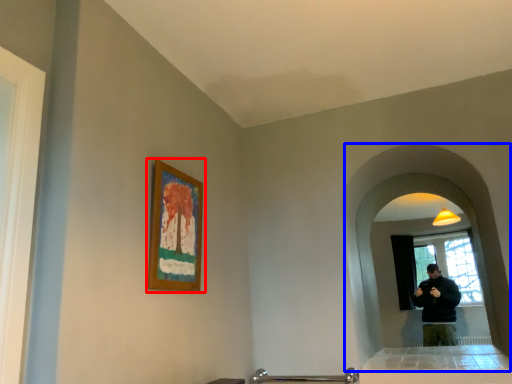
Question: Which object appears closest to the camera in this image, picture frame (highlighted by a red box) or mirror (highlighted by a blue box)?

Choices:
 (A) picture frame
 (B) mirror

Answer: (A)